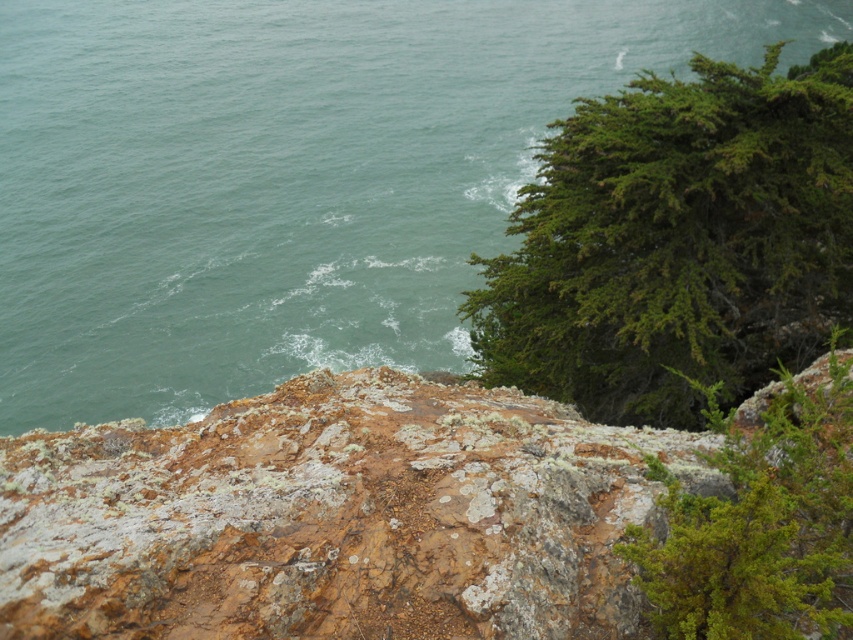
Question: Can you confirm if green water at upper left is positioned below lichen-covered rock at center?

Choices:
 (A) yes
 (B) no

Answer: (B)

Question: Can you confirm if green water at upper left is positioned to the left of lichen-covered rock at center?

Choices:
 (A) yes
 (B) no

Answer: (A)

Question: Among these points, which one is nearest to the camera?

Choices:
 (A) (402, 404)
 (B) (79, 400)

Answer: (A)

Question: Does green water at upper left appear over lichen-covered rock at center?

Choices:
 (A) no
 (B) yes

Answer: (B)

Question: Among these points, which one is nearest to the camera?

Choices:
 (A) (160, 161)
 (B) (316, 544)

Answer: (B)